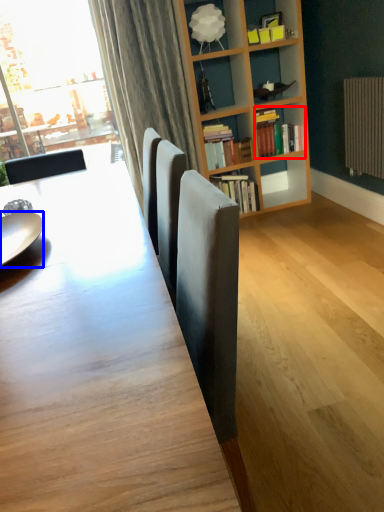
Question: Among these objects, which one is nearest to the camera, book (highlighted by a red box) or plate (highlighted by a blue box)?

Choices:
 (A) book
 (B) plate

Answer: (B)